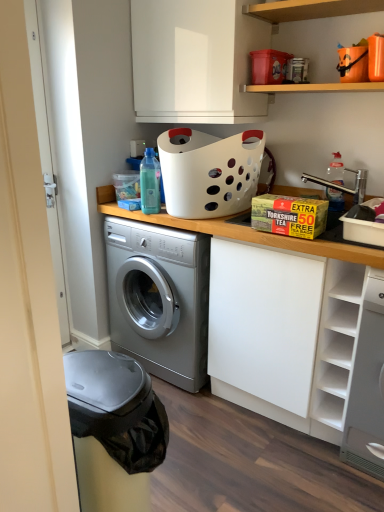
Question: Considering the relative sizes of white matte shelf at right, acting as the 1th shelf starting from the bottom, and white glossy cabinet at upper center in the image provided, is white matte shelf at right, acting as the 1th shelf starting from the bottom, taller than white glossy cabinet at upper center?

Choices:
 (A) no
 (B) yes

Answer: (B)

Question: From the image's perspective, would you say white matte shelf at right, acting as the 1th shelf starting from the bottom, is positioned over white glossy cabinet at upper center?

Choices:
 (A) yes
 (B) no

Answer: (B)

Question: Is white matte shelf at right, acting as the 1th shelf starting from the bottom, thinner than white glossy cabinet at upper center?

Choices:
 (A) yes
 (B) no

Answer: (B)

Question: Is white matte shelf at right, acting as the 1th shelf starting from the bottom, to the left of white glossy cabinet at upper center from the viewer's perspective?

Choices:
 (A) yes
 (B) no

Answer: (B)

Question: From the image's perspective, is wooden shelf at upper center, placed as the second shelf when sorted from bottom to top, positioned above or below white matte cabinet at center?

Choices:
 (A) below
 (B) above

Answer: (B)

Question: Relative to white matte cabinet at center, is wooden shelf at upper center, placed as the second shelf when sorted from bottom to top, in front or behind?

Choices:
 (A) front
 (B) behind

Answer: (B)

Question: Does point (352, 9) appear closer or farther from the camera than point (311, 242)?

Choices:
 (A) farther
 (B) closer

Answer: (A)

Question: Looking at the image, does wooden shelf at upper center, placed as the second shelf when sorted from bottom to top, seem bigger or smaller compared to white matte cabinet at center?

Choices:
 (A) big
 (B) small

Answer: (B)

Question: Considering the positions of clear plastic bottle at upper right, placed as the 2th bottle when sorted from left to right, and white matte shelf at right, acting as the 1th shelf starting from the bottom, in the image, is clear plastic bottle at upper right, placed as the 2th bottle when sorted from left to right, bigger or smaller than white matte shelf at right, acting as the 1th shelf starting from the bottom,?

Choices:
 (A) big
 (B) small

Answer: (B)

Question: From their relative heights in the image, would you say clear plastic bottle at upper right, which is the first bottle in right-to-left order, is taller or shorter than white matte shelf at right, positioned as the 2th shelf in top-to-bottom order?

Choices:
 (A) tall
 (B) short

Answer: (B)

Question: From the image's perspective, is clear plastic bottle at upper right, which is the first bottle in right-to-left order, positioned above or below white matte shelf at right, acting as the 1th shelf starting from the bottom?

Choices:
 (A) above
 (B) below

Answer: (A)

Question: In the image, is clear plastic bottle at upper right, which is the first bottle in right-to-left order, positioned in front of or behind white matte shelf at right, positioned as the 2th shelf in top-to-bottom order?

Choices:
 (A) behind
 (B) front

Answer: (A)

Question: Is white smooth door at left wider or thinner than white matte cabinet at center?

Choices:
 (A) thin
 (B) wide

Answer: (A)

Question: Considering the positions of white smooth door at left and white matte cabinet at center in the image, is white smooth door at left bigger or smaller than white matte cabinet at center?

Choices:
 (A) small
 (B) big

Answer: (A)